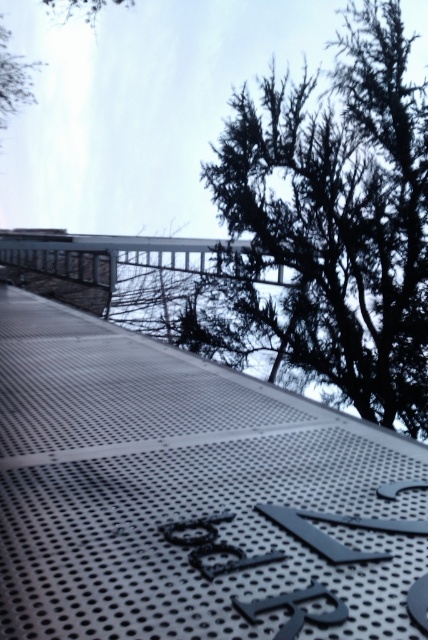
Question: Can you confirm if metallic perforated ramp at center is wider than dark green textured tree at upper right?

Choices:
 (A) no
 (B) yes

Answer: (B)

Question: Which object is farther from the camera taking this photo?

Choices:
 (A) metallic perforated ramp at center
 (B) dark green textured tree at upper right

Answer: (B)

Question: Observing the image, what is the correct spatial positioning of metallic perforated ramp at center in reference to dark green textured tree at upper right?

Choices:
 (A) above
 (B) below

Answer: (B)

Question: Is metallic perforated ramp at center smaller than dark green textured tree at upper right?

Choices:
 (A) no
 (B) yes

Answer: (A)